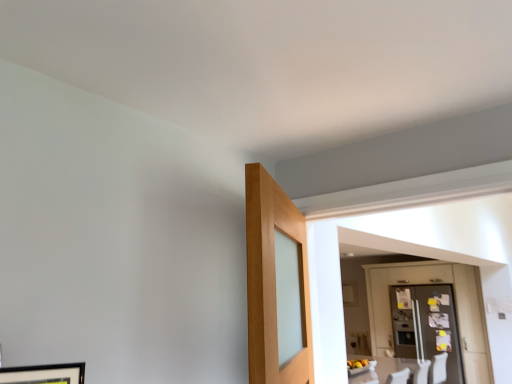
What do you see at coordinates (430, 283) in the screenshot? The width and height of the screenshot is (512, 384). I see `matte gray refrigerator at right` at bounding box center [430, 283].

The height and width of the screenshot is (384, 512). Find the location of `matte gray refrigerator at right`. matte gray refrigerator at right is located at coordinates (430, 283).

Image resolution: width=512 pixels, height=384 pixels. I want to click on clear glass refrigerator at right, so click(426, 326).

Image resolution: width=512 pixels, height=384 pixels. Describe the element at coordinates (426, 326) in the screenshot. I see `clear glass refrigerator at right` at that location.

The image size is (512, 384). Identify the location of matte gray refrigerator at right. (430, 283).

Between clear glass refrigerator at right and matte gray refrigerator at right, which one appears on the right side from the viewer's perspective?

clear glass refrigerator at right.

Is the depth of clear glass refrigerator at right less than that of matte gray refrigerator at right?

No, clear glass refrigerator at right is further to the viewer.

Considering the positions of points (454, 357) and (481, 372), is point (454, 357) farther from camera compared to point (481, 372)?

That is True.

From the image's perspective, is clear glass refrigerator at right beneath matte gray refrigerator at right?

Yes, from the image's perspective, clear glass refrigerator at right is beneath matte gray refrigerator at right.

From a real-world perspective, is clear glass refrigerator at right located beneath matte gray refrigerator at right?

Correct, in the physical world, clear glass refrigerator at right is lower than matte gray refrigerator at right.

Can you confirm if clear glass refrigerator at right is thinner than matte gray refrigerator at right?

No, clear glass refrigerator at right is not thinner than matte gray refrigerator at right.

Considering the relative sizes of clear glass refrigerator at right and matte gray refrigerator at right in the image provided, is clear glass refrigerator at right shorter than matte gray refrigerator at right?

Yes, clear glass refrigerator at right is shorter than matte gray refrigerator at right.

In terms of size, does clear glass refrigerator at right appear bigger or smaller than matte gray refrigerator at right?

clear glass refrigerator at right is smaller than matte gray refrigerator at right.

Is matte gray refrigerator at right surrounded by clear glass refrigerator at right?

Indeed, matte gray refrigerator at right is located within clear glass refrigerator at right.

Is clear glass refrigerator at right beside matte gray refrigerator at right?

No, clear glass refrigerator at right is not touching matte gray refrigerator at right.

Could you tell me if clear glass refrigerator at right is facing matte gray refrigerator at right?

Yes, clear glass refrigerator at right faces towards matte gray refrigerator at right.

Where is `door on the left of clear glass refrigerator at right`? The width and height of the screenshot is (512, 384). door on the left of clear glass refrigerator at right is located at coordinates (430, 283).

Considering the positions of objects matte gray refrigerator at right and clear glass refrigerator at right in the image provided, who is more to the left, matte gray refrigerator at right or clear glass refrigerator at right?

From the viewer's perspective, matte gray refrigerator at right appears more on the left side.

From the picture: Does matte gray refrigerator at right come in front of clear glass refrigerator at right?

Yes, matte gray refrigerator at right is in front of clear glass refrigerator at right.

Which is less distant, (435, 262) or (426, 315)?

The point (426, 315) is closer to the camera.

From the image's perspective, which object appears higher, matte gray refrigerator at right or clear glass refrigerator at right?

matte gray refrigerator at right is shown above in the image.

From the picture: From a real-world perspective, who is located lower, matte gray refrigerator at right or clear glass refrigerator at right?

clear glass refrigerator at right is physically lower.

Considering the sizes of objects matte gray refrigerator at right and clear glass refrigerator at right in the image provided, who is wider, matte gray refrigerator at right or clear glass refrigerator at right?

With larger width is clear glass refrigerator at right.

Considering the relative sizes of matte gray refrigerator at right and clear glass refrigerator at right in the image provided, is matte gray refrigerator at right shorter than clear glass refrigerator at right?

Incorrect, the height of matte gray refrigerator at right does not fall short of that of clear glass refrigerator at right.

Considering the relative sizes of matte gray refrigerator at right and clear glass refrigerator at right in the image provided, is matte gray refrigerator at right bigger than clear glass refrigerator at right?

Yes, matte gray refrigerator at right is bigger than clear glass refrigerator at right.

Is clear glass refrigerator at right completely or partially inside matte gray refrigerator at right?

Yes, clear glass refrigerator at right is inside matte gray refrigerator at right.

Looking at this image, are matte gray refrigerator at right and clear glass refrigerator at right making contact?

matte gray refrigerator at right is not next to clear glass refrigerator at right, and they're not touching.

Is matte gray refrigerator at right turned away from clear glass refrigerator at right?

That's right, matte gray refrigerator at right is facing away from clear glass refrigerator at right.

What's the angular difference between matte gray refrigerator at right and clear glass refrigerator at right's facing directions?

The facing directions of matte gray refrigerator at right and clear glass refrigerator at right are 0.000507 degrees apart.

Measure the distance from matte gray refrigerator at right to clear glass refrigerator at right.

matte gray refrigerator at right and clear glass refrigerator at right are 7.69 inches apart from each other.

Find the location of a particular element. Image resolution: width=512 pixels, height=384 pixels. glass door that is under the matte gray refrigerator at right (from a real-world perspective) is located at coordinates (426, 326).

Locate an element on the screen. This screenshot has width=512, height=384. glass door that is under the matte gray refrigerator at right (from a real-world perspective) is located at coordinates (426, 326).

The width and height of the screenshot is (512, 384). What are the coordinates of `door above the clear glass refrigerator at right (from the image's perspective)` in the screenshot? It's located at (430, 283).